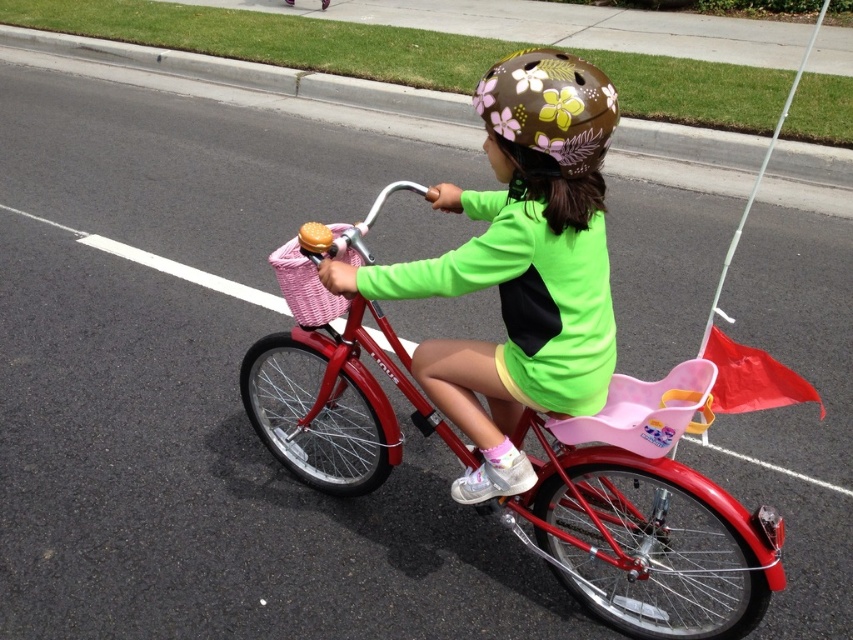
Question: Which point is closer to the camera taking this photo?

Choices:
 (A) (538, 381)
 (B) (515, 52)

Answer: (B)

Question: Can you confirm if matte brown helmet at center is positioned to the right of brown floral-patterned helmet at upper center?

Choices:
 (A) no
 (B) yes

Answer: (A)

Question: Which of the following is the closest to the observer?

Choices:
 (A) (585, 116)
 (B) (543, 188)
 (C) (566, 420)

Answer: (A)

Question: Which point is closer to the camera?

Choices:
 (A) brown floral-patterned helmet at upper center
 (B) shiny red bicycle at center
 (C) matte brown helmet at center

Answer: (C)

Question: Is matte brown helmet at center closer to the viewer compared to brown floral-patterned helmet at upper center?

Choices:
 (A) yes
 (B) no

Answer: (A)

Question: Can you confirm if matte brown helmet at center is bigger than brown floral-patterned helmet at upper center?

Choices:
 (A) yes
 (B) no

Answer: (A)